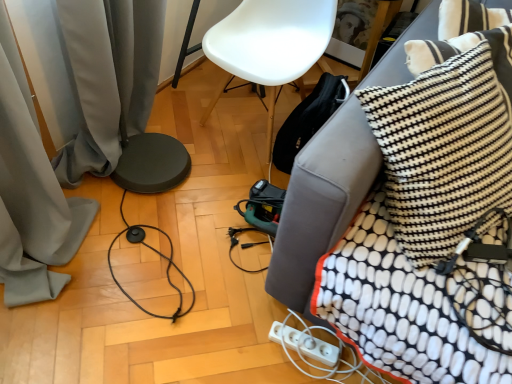
Locate an element on the screen. free location in front of white plastic power strip at lower right is located at coordinates (295, 372).